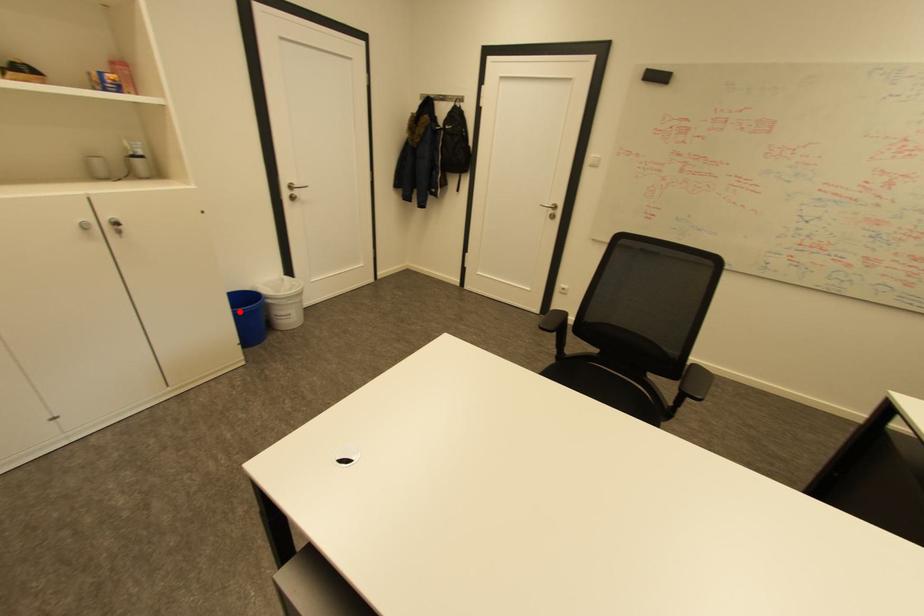
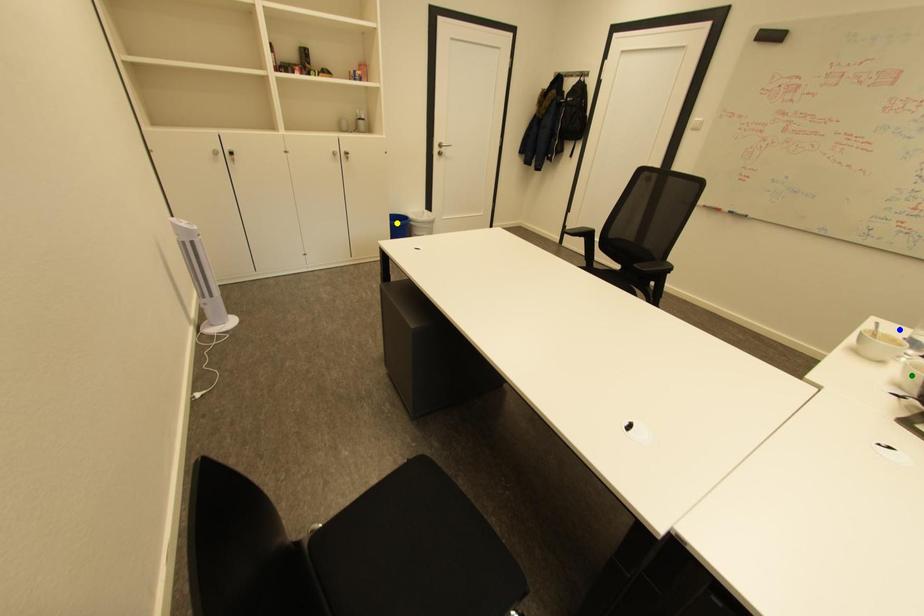
Question: I am providing you with two images of the same scene from different viewpoints. A red point is marked on the first image. You are given multiple points on the second image. Which spot in image 2 lines up with the point in image 1?

Choices:
 (A) blue point
 (B) green point
 (C) yellow point

Answer: (C)